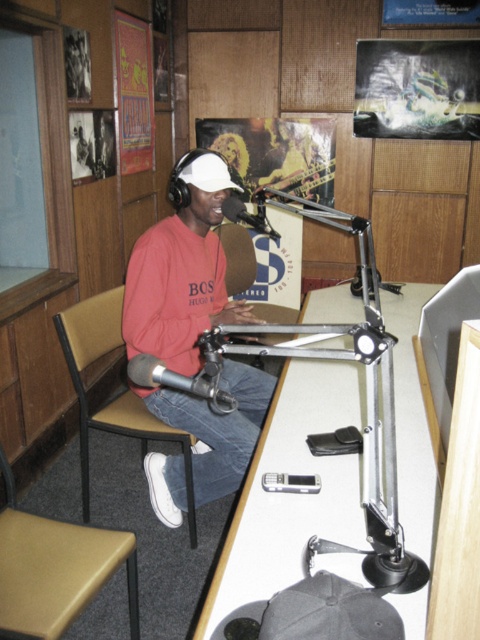
Who is lower down, black metallic microphone at center or silver metallic microphone at center?

Positioned lower is black metallic microphone at center.

Measure the distance between black metallic microphone at center and camera.

black metallic microphone at center and camera are 88.03 centimeters apart.

You are a GUI agent. You are given a task and a screenshot of the screen. Output one action in this format:
    pyautogui.click(x=<x>, y=<y>)
    Task: Click on the black metallic microphone at center
    The width and height of the screenshot is (480, 640).
    Given the screenshot: What is the action you would take?
    pyautogui.click(x=180, y=381)

Looking at this image, between white plastic table at center and black metallic microphone at center, which one has less height?

black metallic microphone at center

Is point (410, 428) more distant than point (189, 380)?

Yes, it is.

The height and width of the screenshot is (640, 480). What are the coordinates of `white plastic table at center` in the screenshot? It's located at (290, 493).

Can you confirm if matte red sweatshirt at center is positioned to the left of brown fabric chair at left?

No, matte red sweatshirt at center is not to the left of brown fabric chair at left.

Who is more distant from viewer, (215, 204) or (80, 317)?

Positioned behind is point (80, 317).

Is point (214, 474) positioned in front of point (131, 401)?

That is True.

Image resolution: width=480 pixels, height=640 pixels. What are the coordinates of `matte red sweatshirt at center` in the screenshot? It's located at (181, 269).